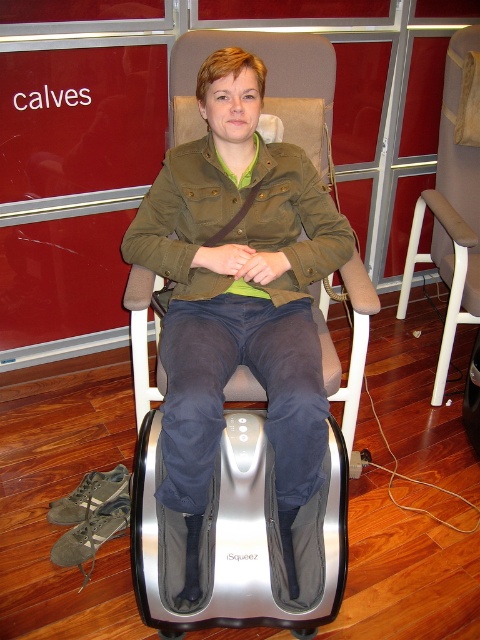
You are an interior designer planning to place a new lamp between the olive green fabric jacket at center and the beige fabric swivel chair at center. Based on their positions, where should the lamp be placed?

The lamp should be placed between the olive green fabric jacket at center and the beige fabric swivel chair at center, as the olive green fabric jacket at center is to the left of the beige fabric swivel chair at center.

You are designing a layout for a small home gym and need to place the olive green canvas jacket at center and the beige fabric swivel chair at center next to each other. Based on the image, which object should be placed first to accommodate their sizes?

The olive green canvas jacket at center is wider than the beige fabric swivel chair at center, so place the olive green canvas jacket at center first to ensure there is enough space for both items.